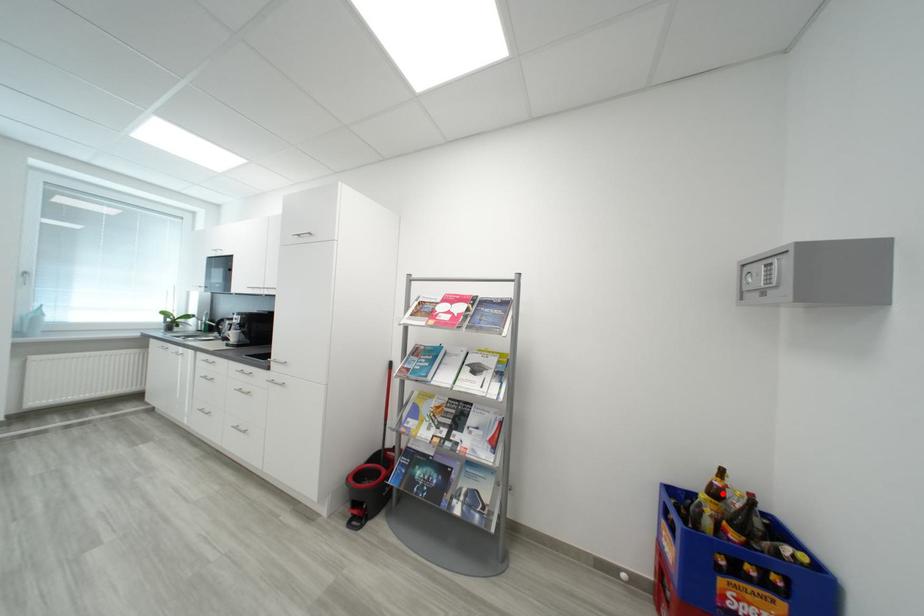
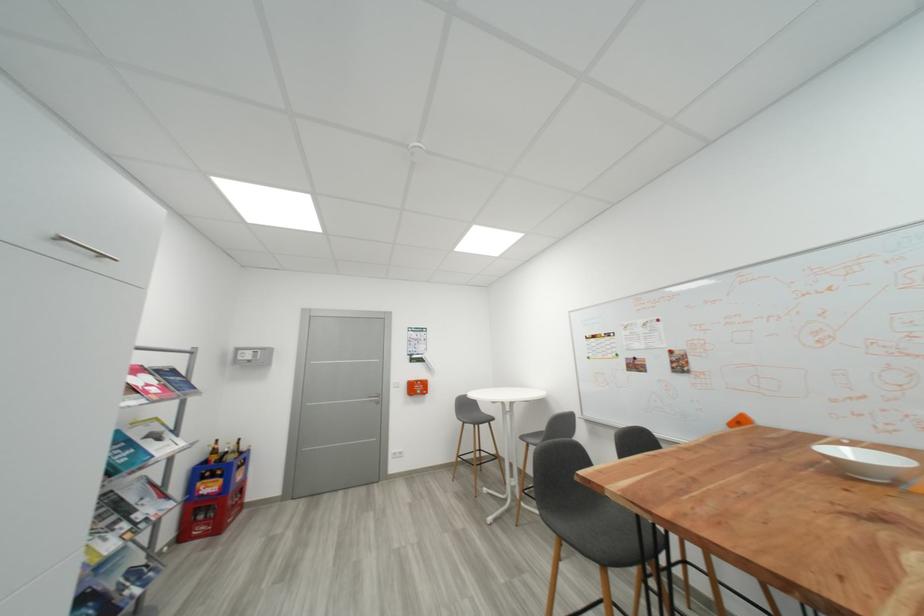
Where in the second image is the point corresponding to the highlighted location from the first image?

(223, 454)